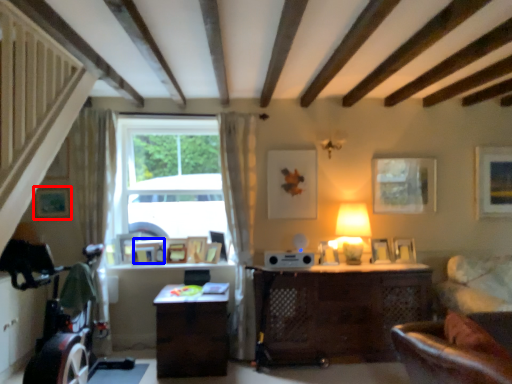
Question: Which of the following is the farthest to the observer, picture frame (highlighted by a red box) or picture frame (highlighted by a blue box)?

Choices:
 (A) picture frame
 (B) picture frame

Answer: (B)